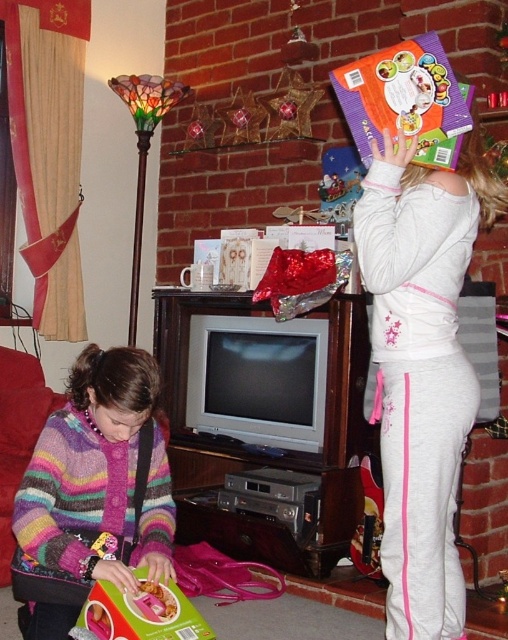
Who is taller, matte gray sweatpants at center or matte pink box at lower left?

matte gray sweatpants at center

Between matte gray sweatpants at center and matte pink box at lower left, which one is positioned lower?

matte pink box at lower left is below.

What do you see at coordinates (422, 369) in the screenshot?
I see `matte gray sweatpants at center` at bounding box center [422, 369].

In order to click on matte gray sweatpants at center in this screenshot , I will do `click(422, 369)`.

Is orange glossy cereal box at upper right wider than matte pink box at lower left?

No.

Is point (357, 109) less distant than point (195, 612)?

No, it is not.

At what (x,y) coordinates should I click in order to perform the action: click on orange glossy cereal box at upper right. Please return your answer as a coordinate pair (x, y). This screenshot has height=640, width=508. Looking at the image, I should click on (405, 100).

Where is `orange glossy cereal box at upper right`? The image size is (508, 640). orange glossy cereal box at upper right is located at coordinates (405, 100).

Who is more forward, (137, 490) or (417, 76)?

Point (417, 76) is more forward.

Describe the element at coordinates (92, 492) in the screenshot. I see `striped wool sweater at lower left` at that location.

Identify the location of striped wool sweater at lower left. (92, 492).